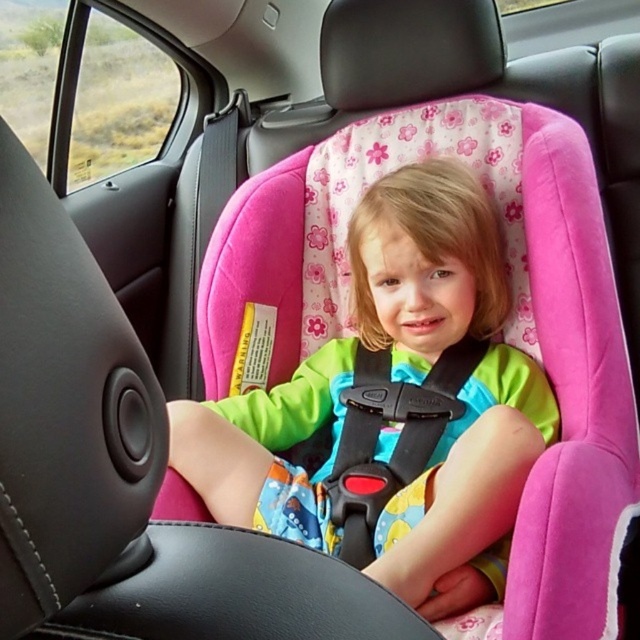
Question: Which point appears closest to the camera in this image?

Choices:
 (A) (321, 513)
 (B) (403, 468)

Answer: (A)

Question: Is the position of pink fabric car seat at center more distant than that of black plastic seatbelt at center?

Choices:
 (A) yes
 (B) no

Answer: (B)

Question: Can you confirm if pink fabric car seat at center is positioned to the right of black plastic seatbelt at center?

Choices:
 (A) yes
 (B) no

Answer: (A)

Question: Which object is closer to the camera taking this photo?

Choices:
 (A) black plastic seatbelt at center
 (B) pink fabric car seat at center

Answer: (B)

Question: Can you confirm if pink fabric car seat at center is wider than black plastic seatbelt at center?

Choices:
 (A) yes
 (B) no

Answer: (A)

Question: Among these objects, which one is farthest from the camera?

Choices:
 (A) black plastic seatbelt at center
 (B) pink fabric car seat at center

Answer: (A)